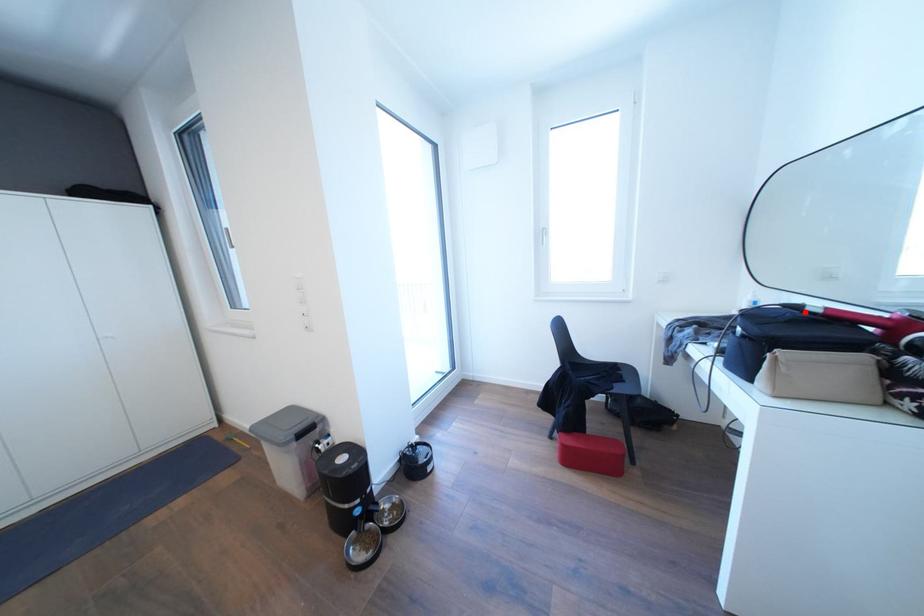
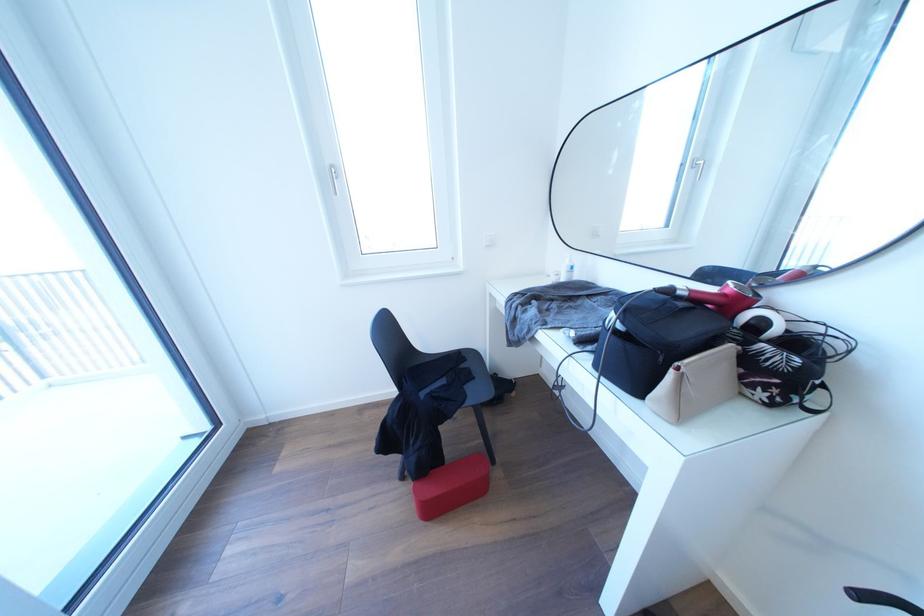
Locate, in the second image, the point that corresponds to the highlighted location in the first image.

(675, 296)